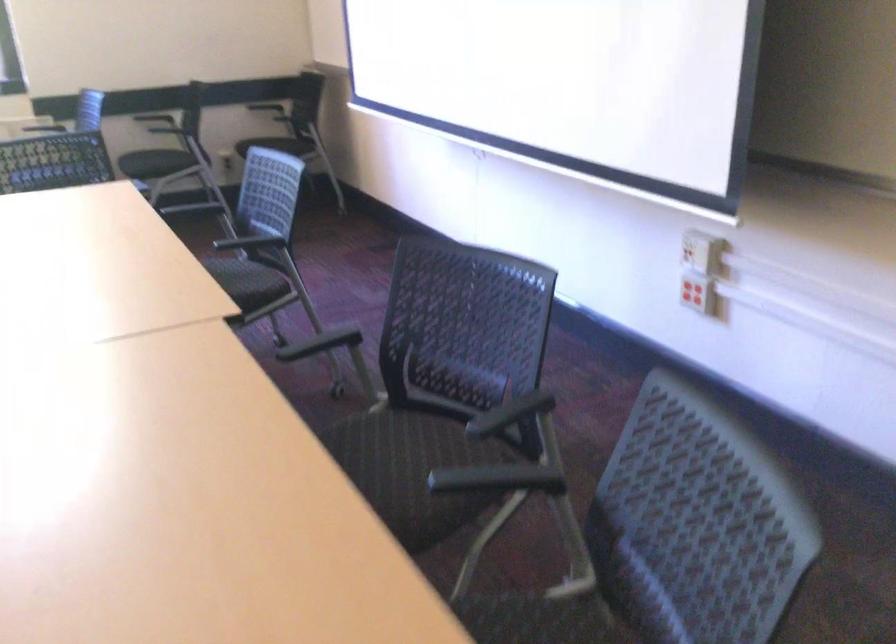
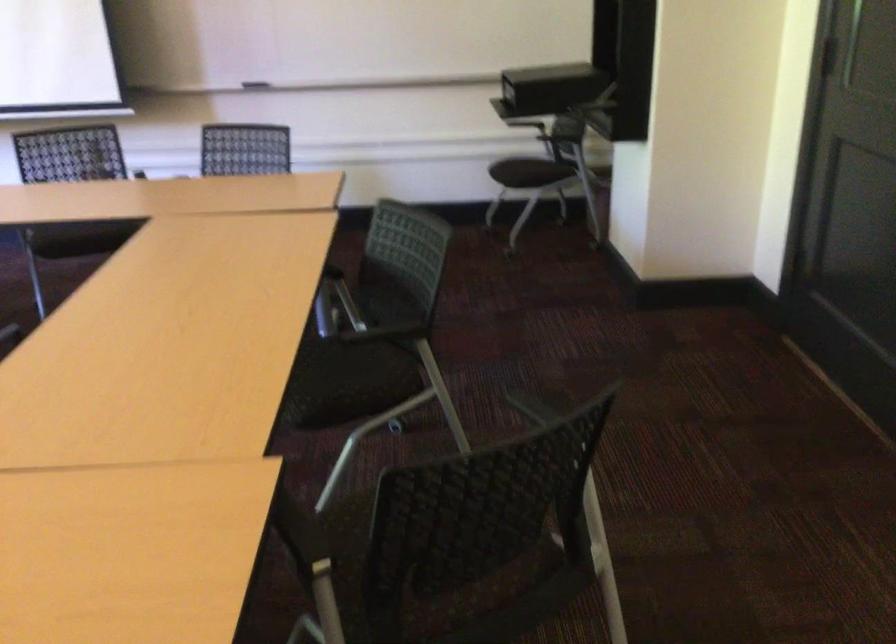
Question: I am providing you with two images of the same scene from different viewpoints. Which of the following objects are not visible in image2?

Choices:
 (A) black document camera
 (B) black chair armrest
 (C) black running shoe
 (D) chair sitting surface

Answer: (B)